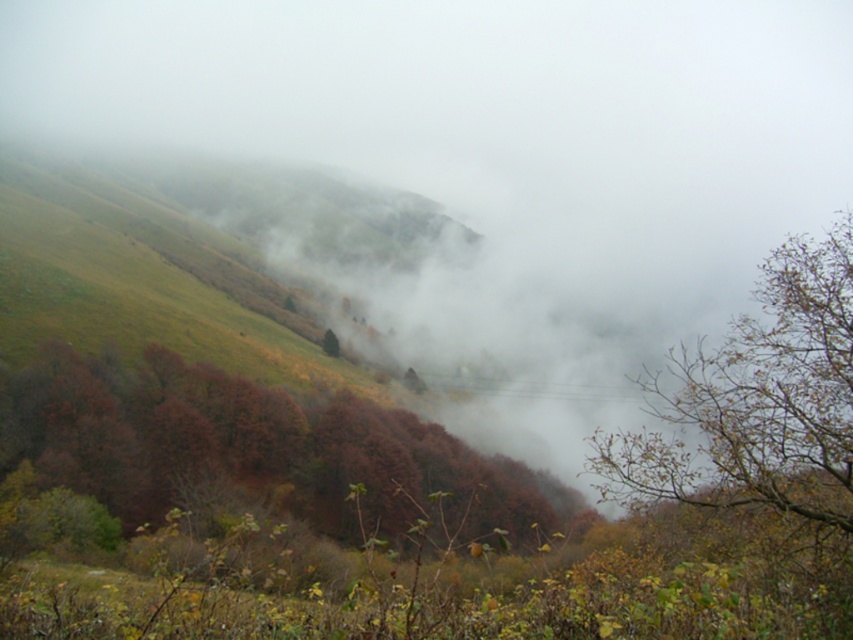
You are an artist planning to paint this scene. You want to ensure the autumn leaves at center and the green matte tree at center are proportionally accurate. Which object should you paint larger?

The autumn leaves at center should be painted larger since they are bigger than the green matte tree at center according to the description.

You are an artist sketching this landscape. You want to ensure the brown leafy branches at right and the green matte tree at center are proportionally accurate. Which object should you draw first to maintain the correct size relationship?

You should draw the green matte tree at center first because it is taller than the brown leafy branches at right, allowing you to establish the correct size relationship between them.